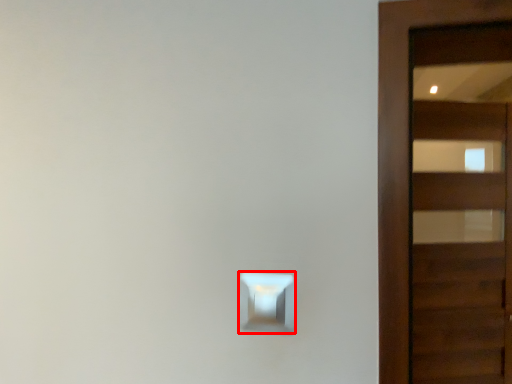
Question: In this image, where is light switch (annotated by the red box) located relative to door?

Choices:
 (A) left
 (B) right

Answer: (A)